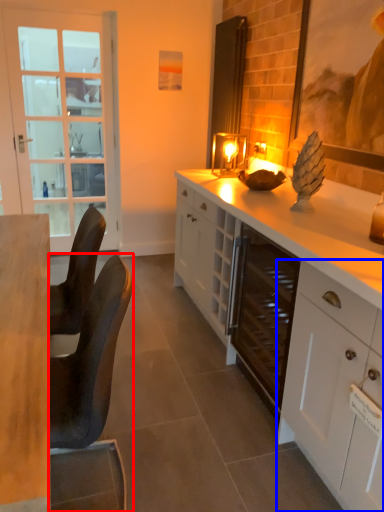
Question: Which object is closer to the camera taking this photo, chair (highlighted by a red box) or cabinetry (highlighted by a blue box)?

Choices:
 (A) chair
 (B) cabinetry

Answer: (B)